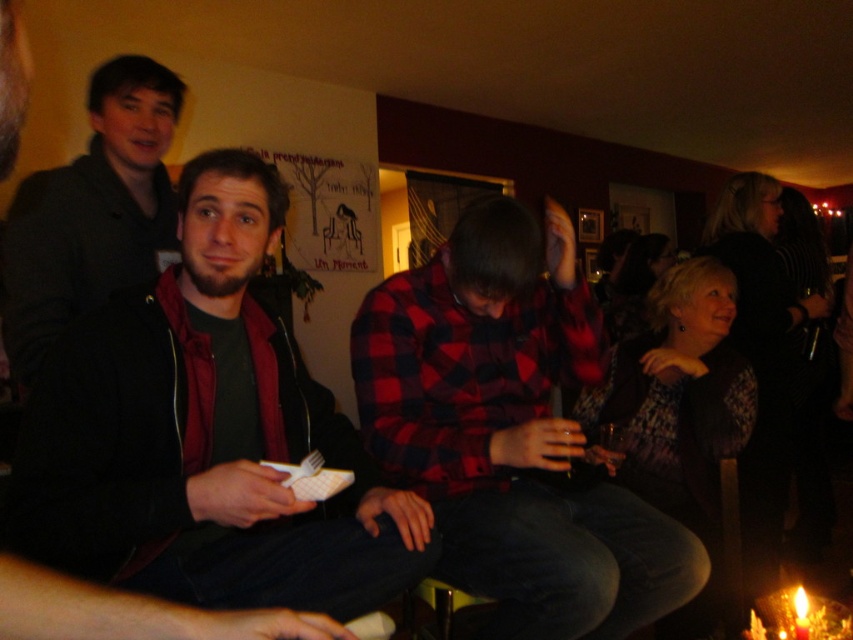
Question: Is matte black jacket at center to the left of red plaid shirt at center from the viewer's perspective?

Choices:
 (A) yes
 (B) no

Answer: (A)

Question: Is matte black jacket at center positioned behind red plaid shirt at center?

Choices:
 (A) yes
 (B) no

Answer: (B)

Question: Based on their relative distances, which object is farther from the red plaid shirt at center?

Choices:
 (A) matte black jacket at center
 (B) matte black jacket at upper left

Answer: (B)

Question: Which point is farther from the camera taking this photo?

Choices:
 (A) (62, 172)
 (B) (347, 577)
 (C) (554, 566)

Answer: (A)

Question: Where is red plaid shirt at center located in relation to matte black jacket at upper left in the image?

Choices:
 (A) left
 (B) right

Answer: (B)

Question: Which is farther from the red plaid shirt at center?

Choices:
 (A) matte black jacket at center
 (B) matte black jacket at upper left

Answer: (B)